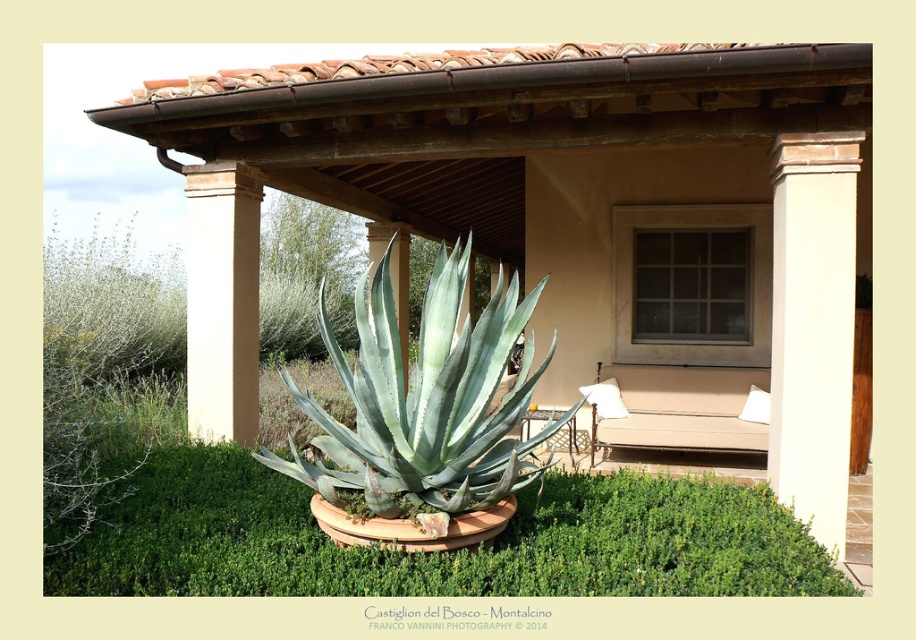
Does green succulent at center have a larger size compared to white smooth column at right?

Indeed, green succulent at center has a larger size compared to white smooth column at right.

The image size is (916, 640). I want to click on green succulent at center, so click(424, 417).

Image resolution: width=916 pixels, height=640 pixels. What do you see at coordinates (424, 417) in the screenshot?
I see `green succulent at center` at bounding box center [424, 417].

Identify the location of green succulent at center. The width and height of the screenshot is (916, 640). (424, 417).

Is point (168, 164) more distant than point (254, 376)?

No, it is not.

Between point (655, 352) and point (202, 164), which one is positioned in front?

Point (202, 164) is in front.

The image size is (916, 640). Identify the location of brown wood pergola at center. coord(562,212).

Looking at this image, does brown wood pergola at center have a greater width compared to green succulent at center?

Yes.

Which is below, brown wood pergola at center or green succulent at center?

green succulent at center is below.

Which is behind, point (860, 156) or point (442, 448)?

Positioned behind is point (860, 156).

The height and width of the screenshot is (640, 916). Identify the location of brown wood pergola at center. (562, 212).